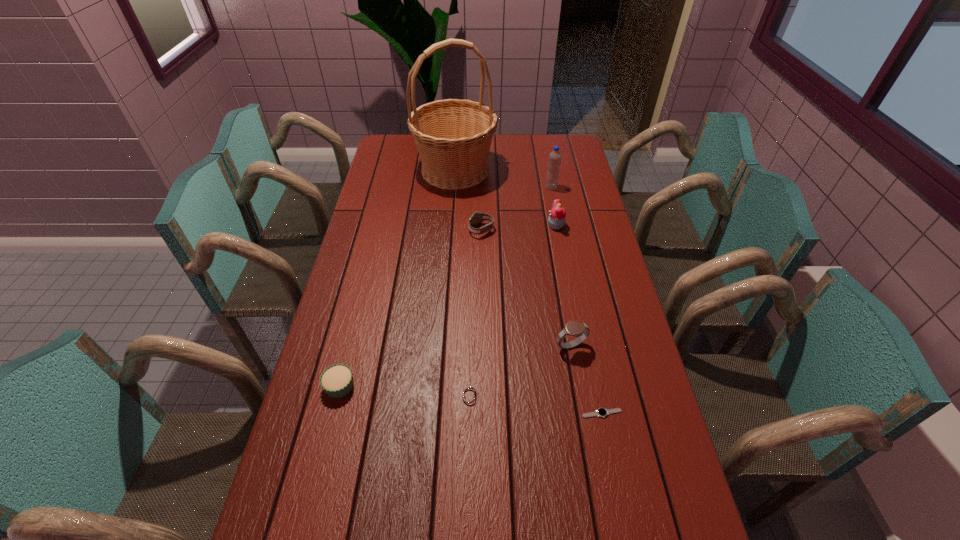
Locate an element on the screen. This screenshot has height=540, width=960. vacant space situated 0.290m on the face of the third shortest watch is located at coordinates (388, 230).

Find the location of a particular element. Image resolution: width=960 pixels, height=540 pixels. vacant space located on the right of the third shortest object is located at coordinates (378, 386).

This screenshot has width=960, height=540. I want to click on free point located on the face of the second shortest object, so click(x=580, y=395).

The height and width of the screenshot is (540, 960). Identify the location of vacant position located on the left of the shortest watch. (541, 413).

You are a GUI agent. You are given a task and a screenshot of the screen. Output one action in this format:
    pyautogui.click(x=<x>, y=<y>)
    Task: Click on the object located at the far edge
    
    Given the screenshot: What is the action you would take?
    pyautogui.click(x=453, y=137)

I want to click on basket present at the left edge, so click(453, 137).

You are a GUI agent. You are given a task and a screenshot of the screen. Output one action in this format:
    pyautogui.click(x=<x>, y=<y>)
    Task: Click on the cupcake located at the left edge
    This screenshot has width=960, height=540.
    Given the screenshot: What is the action you would take?
    pyautogui.click(x=337, y=380)

Where is `water bottle that is at the right edge`? The height and width of the screenshot is (540, 960). water bottle that is at the right edge is located at coordinates (554, 162).

Identify the location of cupcake at the right edge. This screenshot has height=540, width=960. (557, 217).

Image resolution: width=960 pixels, height=540 pixels. Find the location of `object that is positioned at the far left corner`. object that is positioned at the far left corner is located at coordinates point(453,137).